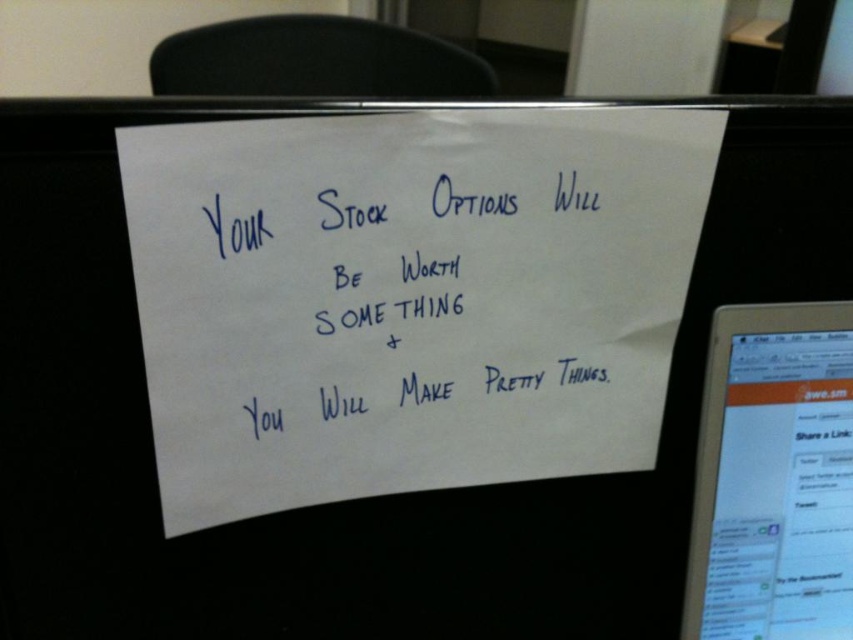
Question: Is white paper at center closer to camera compared to blue ink writing at center?

Choices:
 (A) no
 (B) yes

Answer: (B)

Question: Which point appears closest to the camera in this image?

Choices:
 (A) (761, 621)
 (B) (224, 216)
 (C) (149, 282)

Answer: (C)

Question: Which of these objects is positioned farthest from the blue ink writing at center?

Choices:
 (A) white paper at center
 (B) white glossy tablet at upper right

Answer: (B)

Question: Which point is farther from the camera taking this photo?

Choices:
 (A) (253, 256)
 (B) (605, 282)

Answer: (B)

Question: Is blue ink writing at center bigger than white glossy tablet at upper right?

Choices:
 (A) yes
 (B) no

Answer: (A)

Question: Is white paper at center above white glossy tablet at upper right?

Choices:
 (A) yes
 (B) no

Answer: (A)